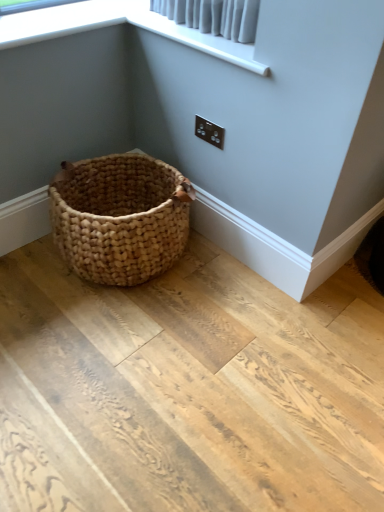
Question: Does black plastic electric outlet at upper right lie in front of white fabric at upper center?

Choices:
 (A) no
 (B) yes

Answer: (A)

Question: Is black plastic electric outlet at upper right at the left side of white fabric at upper center?

Choices:
 (A) no
 (B) yes

Answer: (A)

Question: Considering the relative sizes of black plastic electric outlet at upper right and white fabric at upper center in the image provided, is black plastic electric outlet at upper right shorter than white fabric at upper center?

Choices:
 (A) yes
 (B) no

Answer: (B)

Question: Is white fabric at upper center a part of black plastic electric outlet at upper right?

Choices:
 (A) yes
 (B) no

Answer: (B)

Question: Is black plastic electric outlet at upper right positioned far away from white fabric at upper center?

Choices:
 (A) no
 (B) yes

Answer: (A)

Question: From the image's perspective, is black plastic electric outlet at upper right above white fabric at upper center?

Choices:
 (A) yes
 (B) no

Answer: (B)

Question: Is white fabric at upper center at the right side of black plastic electric outlet at upper right?

Choices:
 (A) yes
 (B) no

Answer: (B)

Question: From the image's perspective, is white fabric at upper center located beneath black plastic electric outlet at upper right?

Choices:
 (A) no
 (B) yes

Answer: (A)

Question: Is white fabric at upper center shorter than black plastic electric outlet at upper right?

Choices:
 (A) no
 (B) yes

Answer: (B)

Question: From a real-world perspective, does white fabric at upper center sit lower than black plastic electric outlet at upper right?

Choices:
 (A) no
 (B) yes

Answer: (A)

Question: Is black plastic electric outlet at upper right at the back of white fabric at upper center?

Choices:
 (A) no
 (B) yes

Answer: (A)

Question: Considering the relative sizes of white fabric at upper center and black plastic electric outlet at upper right in the image provided, is white fabric at upper center smaller than black plastic electric outlet at upper right?

Choices:
 (A) yes
 (B) no

Answer: (B)

Question: Based on their positions, is black plastic electric outlet at upper right located to the left or right of white fabric at upper center?

Choices:
 (A) left
 (B) right

Answer: (B)